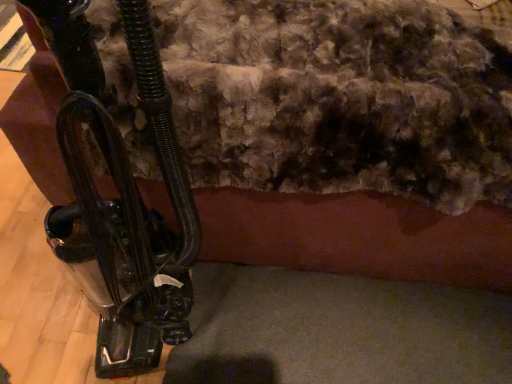
Question: Considering the positions of fuzzy wool at upper center and metallic black vacuum cleaner at left in the image, is fuzzy wool at upper center bigger or smaller than metallic black vacuum cleaner at left?

Choices:
 (A) small
 (B) big

Answer: (B)

Question: Is fuzzy wool at upper center spatially inside metallic black vacuum cleaner at left, or outside of it?

Choices:
 (A) outside
 (B) inside

Answer: (A)

Question: Is point (258, 114) closer or farther from the camera than point (143, 24)?

Choices:
 (A) farther
 (B) closer

Answer: (A)

Question: From the image's perspective, is metallic black vacuum cleaner at left above or below fuzzy wool at upper center?

Choices:
 (A) above
 (B) below

Answer: (B)

Question: Visually, is metallic black vacuum cleaner at left positioned to the left or to the right of fuzzy wool at upper center?

Choices:
 (A) right
 (B) left

Answer: (B)

Question: From a real-world perspective, relative to fuzzy wool at upper center, is metallic black vacuum cleaner at left vertically above or below?

Choices:
 (A) below
 (B) above

Answer: (B)

Question: Considering the positions of metallic black vacuum cleaner at left and fuzzy wool at upper center in the image, is metallic black vacuum cleaner at left bigger or smaller than fuzzy wool at upper center?

Choices:
 (A) big
 (B) small

Answer: (B)